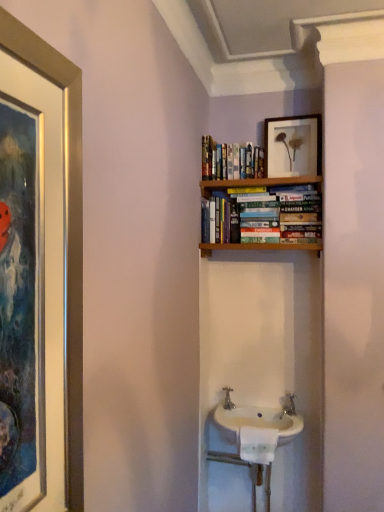
Question: Relative to matte wooden picture frame at upper center, is white ceramic sink at center in front or behind?

Choices:
 (A) behind
 (B) front

Answer: (B)

Question: From a real-world perspective, relative to matte wooden picture frame at upper center, is white ceramic sink at center vertically above or below?

Choices:
 (A) below
 (B) above

Answer: (A)

Question: Based on their relative distances, which object is nearer to the hardcover books at upper center?

Choices:
 (A) white ceramic sink at center
 (B) matte wooden picture frame at upper center
 (C) silver metallic tap at center

Answer: (B)

Question: Which is nearer to the silver metallic tap at center?

Choices:
 (A) hardcover books at upper center
 (B) white ceramic sink at center
 (C) matte wooden picture frame at upper center

Answer: (B)